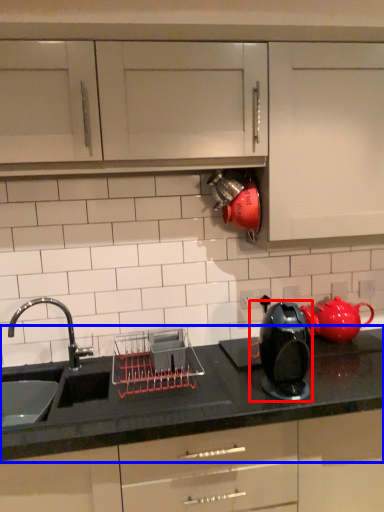
Question: Which object appears closest to the camera in this image, home appliance (highlighted by a red box) or countertop (highlighted by a blue box)?

Choices:
 (A) home appliance
 (B) countertop

Answer: (B)